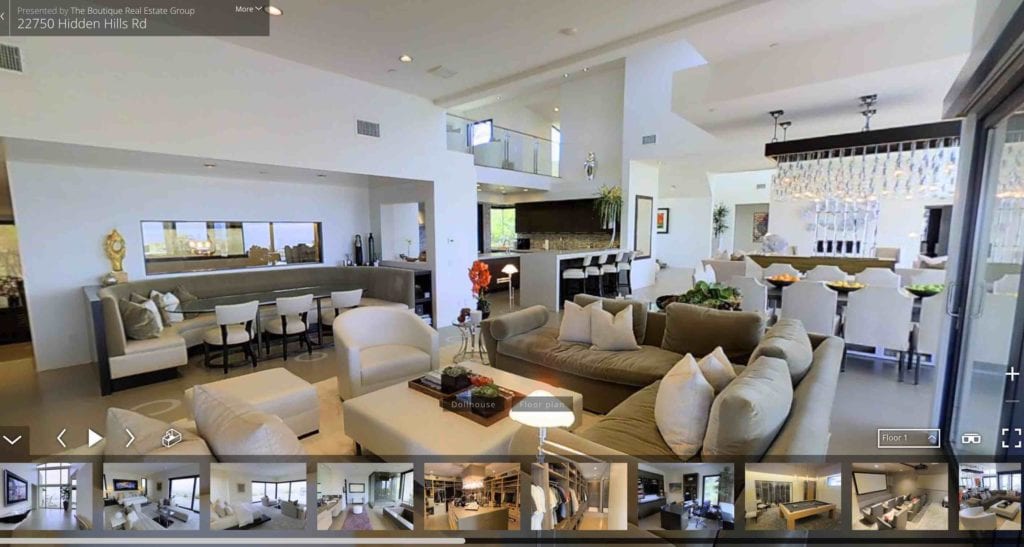
The image size is (1024, 547). Identify the location of chair. (300, 321).